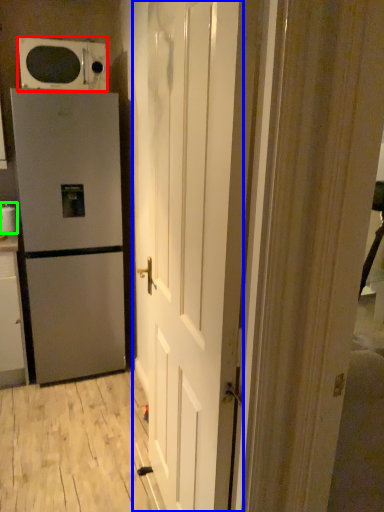
Question: Estimate the real-world distances between objects in this image. Which object is farther from microwave oven (highlighted by a red box), door (highlighted by a blue box) or appliance (highlighted by a green box)?

Choices:
 (A) door
 (B) appliance

Answer: (A)